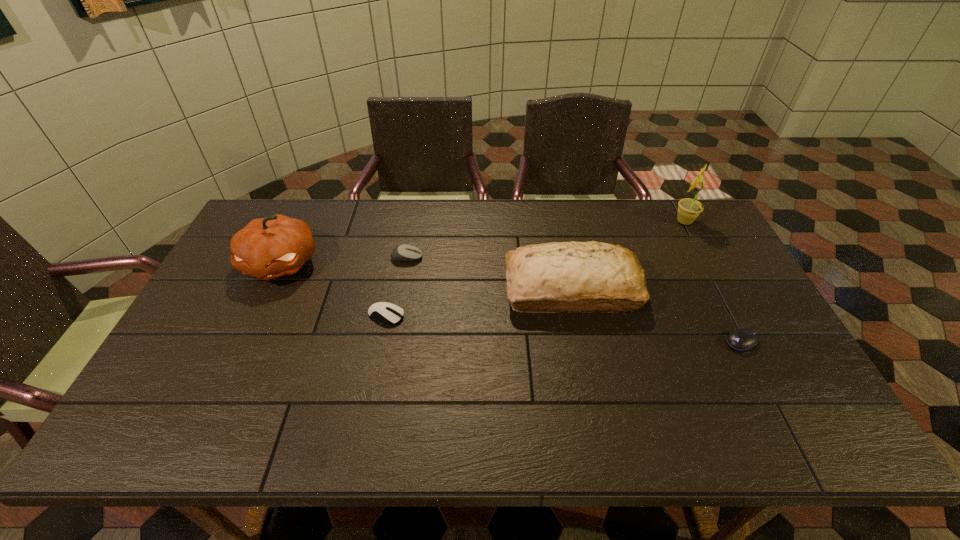
Select which computer mouse is the closest to the farthest object. Please provide its 2D coordinates. Your answer should be formatted as a tuple, i.e. [(x, y)], where the tuple contains the x and y coordinates of a point satisfying the conditions above.

[(742, 339)]

Locate an element on the screen. vacant area that satisfies the following two spatial constraints: 1. on the wheel side of the rightmost computer mouse; 2. on the left side of the farthest computer mouse is located at coordinates (392, 342).

Identify the location of vacant space that satisfies the following two spatial constraints: 1. on the front face of the nearest computer mouse; 2. on the left side of the leftmost object. The height and width of the screenshot is (540, 960). (244, 342).

Identify the location of free space that satisfies the following two spatial constraints: 1. on the front face of the second nearest computer mouse; 2. on the left side of the pumpkin. (256, 315).

Identify the location of blank area in the image that satisfies the following two spatial constraints: 1. on the front side of the rightmost computer mouse; 2. on the right side of the second nearest computer mouse. The width and height of the screenshot is (960, 540). (381, 342).

Find the location of a particular element. The height and width of the screenshot is (540, 960). vacant space that satisfies the following two spatial constraints: 1. on the face of the sunflower; 2. on the front face of the leftmost object is located at coordinates (707, 264).

Identify the location of vacant space that satisfies the following two spatial constraints: 1. on the wheel side of the farthest computer mouse; 2. on the back side of the fourth shortest object. (401, 289).